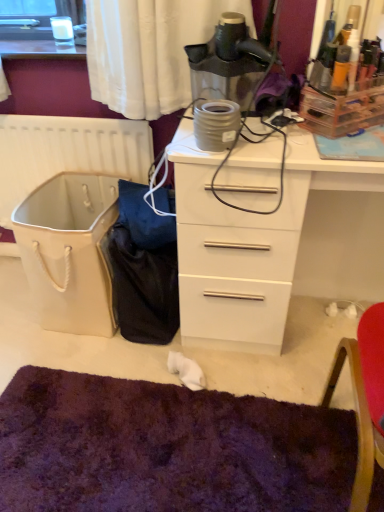
Question: In terms of height, does white plastic radiator at left look taller or shorter compared to matte black hairdryer at upper center?

Choices:
 (A) tall
 (B) short

Answer: (A)

Question: In the image, is white plastic radiator at left on the left side or the right side of matte black hairdryer at upper center?

Choices:
 (A) right
 (B) left

Answer: (B)

Question: Based on their relative distances, which object is nearer to the white plastic radiator at left?

Choices:
 (A) white glossy chest of drawers at center
 (B) white plastic chair at right
 (C) matte black hairdryer at upper center
 (D) purple shaggy mat at lower center

Answer: (C)

Question: Considering the real-world distances, which object is farthest from the white plastic radiator at left?

Choices:
 (A) matte black hairdryer at upper center
 (B) purple shaggy mat at lower center
 (C) white glossy chest of drawers at center
 (D) white plastic chair at right

Answer: (D)